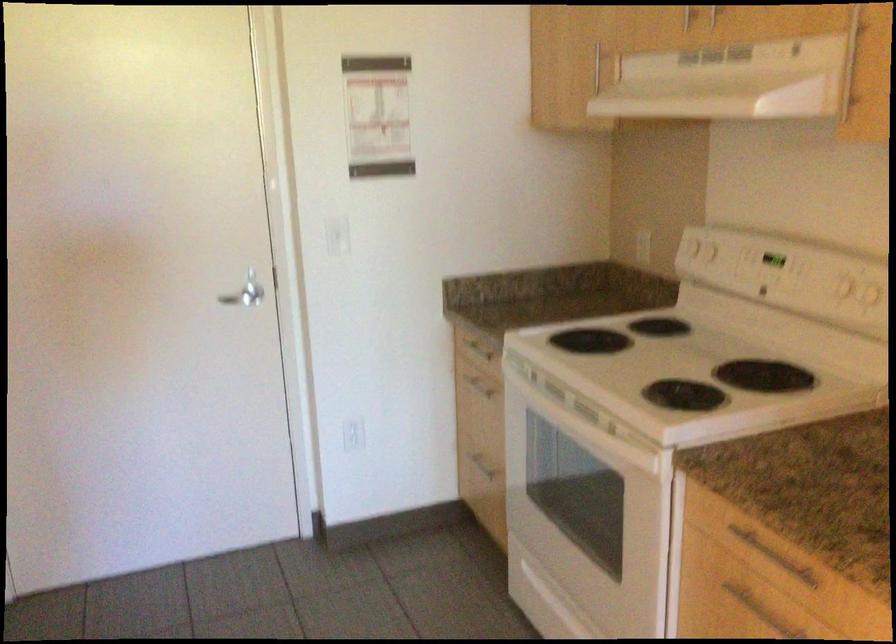
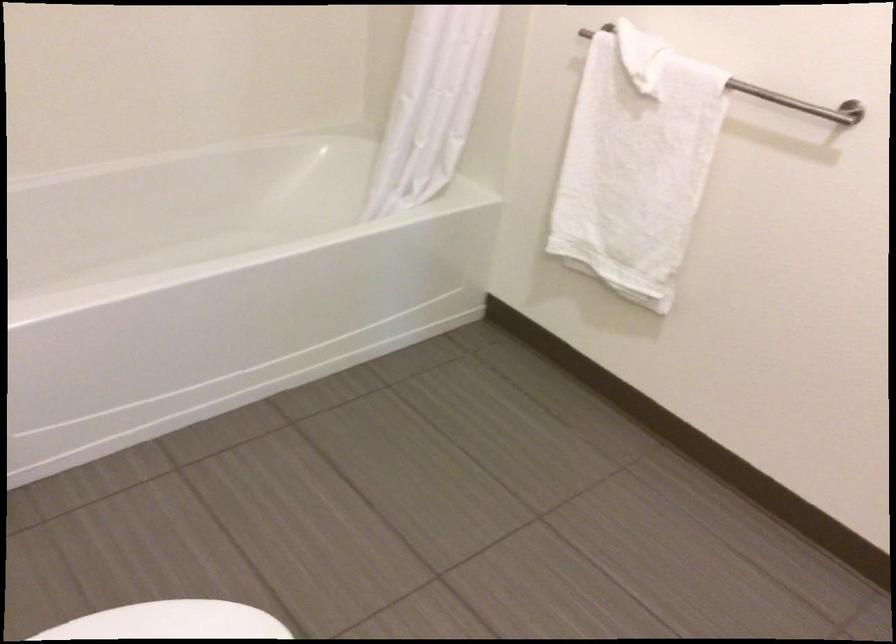
Question: I am providing you with two images of the same scene from different viewpoints. Which of the following objects are not visible in image2?

Choices:
 (A) white light switch
 (B) white shower curtain
 (C) striped chair sitting surface
 (D) white towel

Answer: (A)